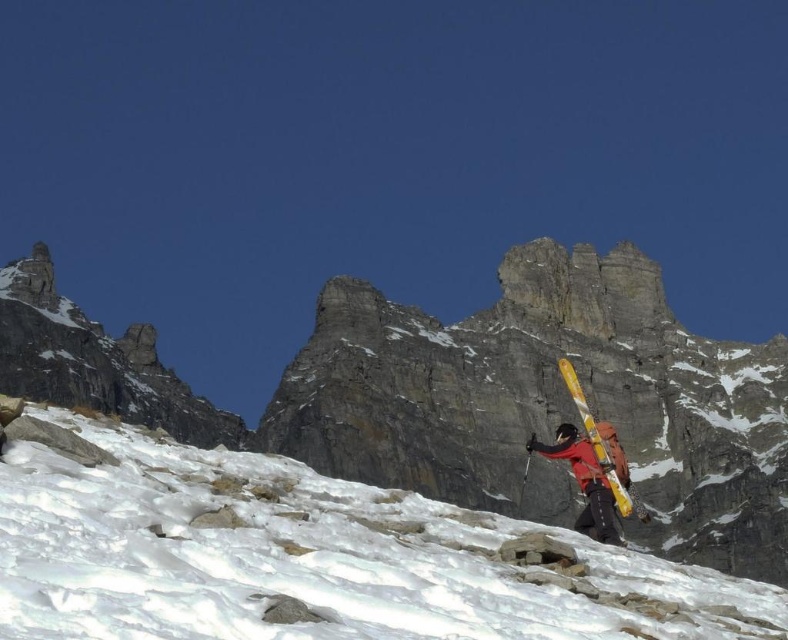
You are a hiker planning to traverse the slope from the yellow metallic skis at center to the white powdery snow at lower right. Which direction should you move to reach the snow?

The white powdery snow at lower right is to the left of the yellow metallic skis at center, so you should move towards the left to reach it.

You are a mountain hiker planning to cross the white powdery snow at lower right and the yellow metallic skis at center. Which path has a wider surface to walk on?

The white powdery snow at lower right has a wider surface than the yellow metallic skis at center because its width surpasses the skis.

You are planning to ski down from the gray rocky mountain at center to the white powdery snow at lower right. Based on the scene description, which direction should you head towards?

You should head towards the lower right direction because the gray rocky mountain at center is located above the white powdery snow at lower right, indicating that the slope descends in that direction.